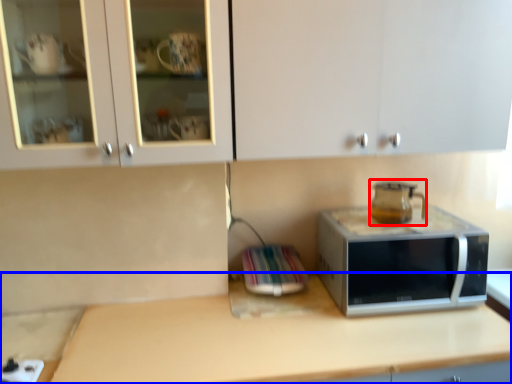
Question: Which of the following is the closest to the observer, coffeepot (highlighted by a red box) or countertop (highlighted by a blue box)?

Choices:
 (A) coffeepot
 (B) countertop

Answer: (B)